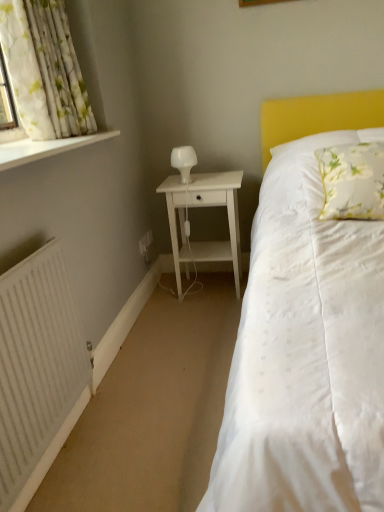
Locate an element on the screen. vacant space in front of white wood nightstand at center is located at coordinates (203, 328).